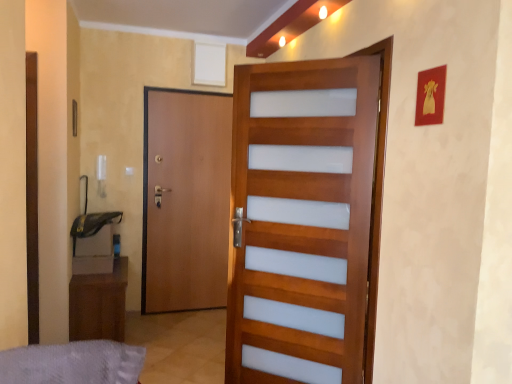
Question: Is point (280, 243) closer or farther from the camera than point (207, 198)?

Choices:
 (A) farther
 (B) closer

Answer: (B)

Question: Is wooden door with frosted panels at center, which appears as the second door when viewed from the back, spatially inside brown wood door at left, which is the 2th door from front to back, or outside of it?

Choices:
 (A) inside
 (B) outside

Answer: (B)

Question: Which object is positioned closest to the gray fabric bed at lower left?

Choices:
 (A) wooden door with frosted panels at center, which appears as the second door when viewed from the back
 (B) brown wood door at left, which is the 1th door from back to front
 (C) brown wood cabinet at lower left

Answer: (A)

Question: Estimate the real-world distances between objects in this image. Which object is closer to the gray fabric bed at lower left?

Choices:
 (A) brown wood cabinet at lower left
 (B) brown wood door at left, which is the 1th door from back to front
 (C) wooden door with frosted panels at center, which appears as the second door when viewed from the back

Answer: (C)